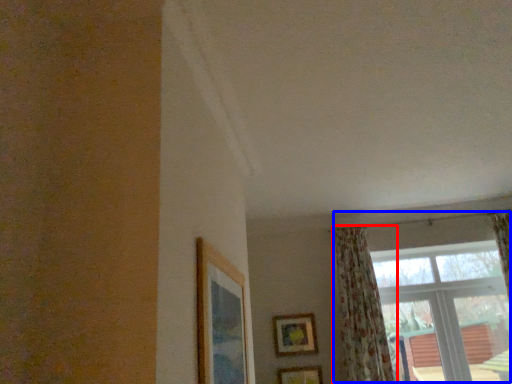
Question: Which object appears farthest to the camera in this image, curtain (highlighted by a red box) or window (highlighted by a blue box)?

Choices:
 (A) curtain
 (B) window

Answer: (B)